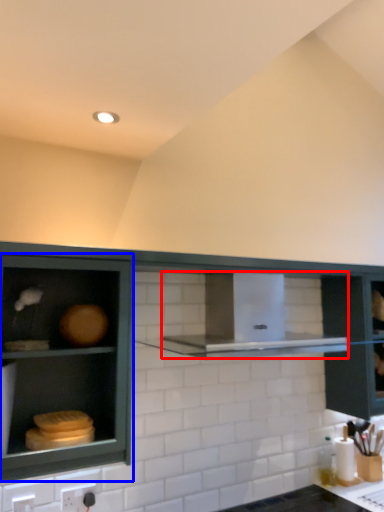
Question: Which object appears farthest to the camera in this image, vent (highlighted by a red box) or cabinetry (highlighted by a blue box)?

Choices:
 (A) vent
 (B) cabinetry

Answer: (A)